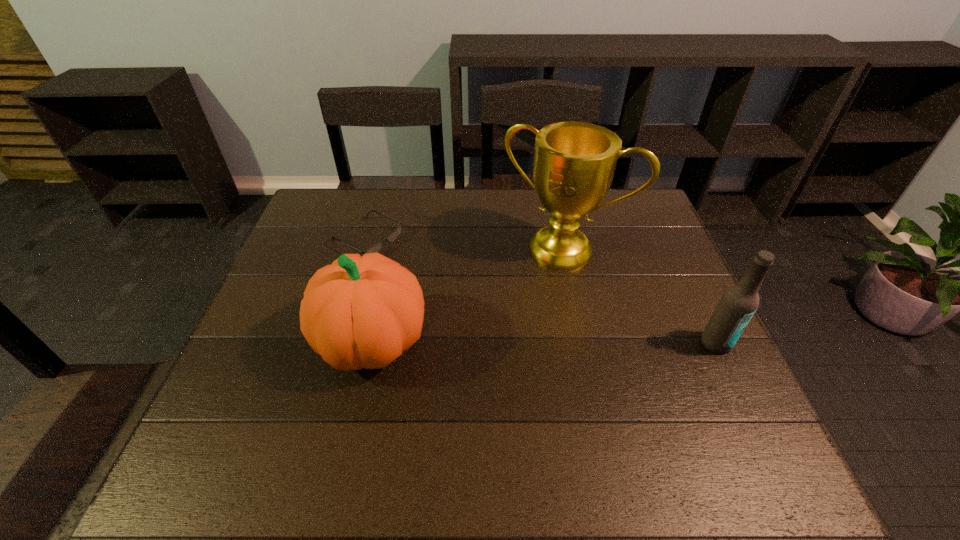
Identify the location of vacant area between the pumpkin and the second object from right to left. This screenshot has width=960, height=540. (468, 295).

The image size is (960, 540). What are the coordinates of `vacant space that's between the spectacles and the beer bottle` in the screenshot? It's located at (541, 291).

You are a GUI agent. You are given a task and a screenshot of the screen. Output one action in this format:
    pyautogui.click(x=<x>, y=<y>)
    Task: Click on the free space between the tallest object and the pumpkin
    
    Given the screenshot: What is the action you would take?
    pyautogui.click(x=468, y=295)

Locate an element on the screen. Image resolution: width=960 pixels, height=540 pixels. vacant space that's between the beer bottle and the third object from left to right is located at coordinates (639, 296).

Find the location of a particular element. empty space that is in between the pumpkin and the award is located at coordinates coord(468,295).

The height and width of the screenshot is (540, 960). I want to click on the second closest object relative to the pumpkin, so click(x=574, y=163).

Point out which object is positioned as the nearest to the award. Please provide its 2D coordinates. Your answer should be formatted as a tuple, i.e. [(x, y)], where the tuple contains the x and y coordinates of a point satisfying the conditions above.

[(359, 312)]